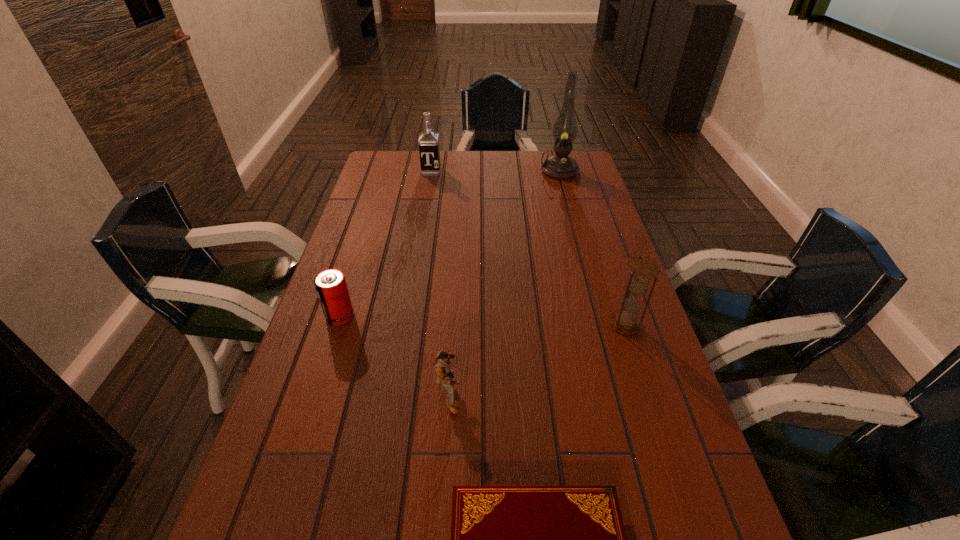
The image size is (960, 540). Find the location of `the fifth closest object to the puncher`. the fifth closest object to the puncher is located at coordinates (560, 166).

Locate which object ranks in proximity to the can. Please provide its 2D coordinates. Your answer should be formatted as a tuple, i.e. [(x, y)], where the tuple contains the x and y coordinates of a point satisfying the conditions above.

[(441, 364)]